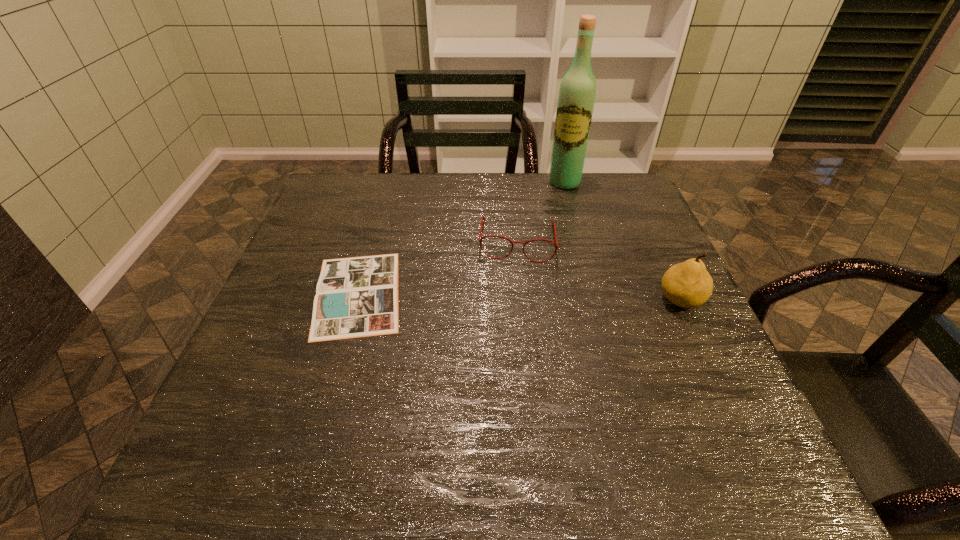
Locate an element on the screen. The image size is (960, 540). free region at the near edge of the desktop is located at coordinates (569, 419).

This screenshot has height=540, width=960. I want to click on free space at the left edge of the desktop, so click(x=299, y=248).

The image size is (960, 540). In order to click on blank space at the right edge of the desktop in this screenshot , I will do `click(646, 300)`.

Image resolution: width=960 pixels, height=540 pixels. Find the location of `blank space at the near left corner of the desktop`. blank space at the near left corner of the desktop is located at coordinates (230, 396).

Where is `free space at the far right corner`? The height and width of the screenshot is (540, 960). free space at the far right corner is located at coordinates (621, 199).

Where is `free location at the near right corner of the desktop`? This screenshot has height=540, width=960. free location at the near right corner of the desktop is located at coordinates (665, 421).

The image size is (960, 540). I want to click on vacant region between the spectacles and the rightmost object, so click(x=599, y=271).

Where is `empty space between the wine bottle and the leftmost object`? The width and height of the screenshot is (960, 540). empty space between the wine bottle and the leftmost object is located at coordinates (461, 238).

At what (x,y) coordinates should I click in order to perform the action: click on blank region between the pear and the wine bottle. Please return your answer as a coordinate pair (x, y). Looking at the image, I should click on (622, 241).

Identify the location of empty space between the third shortest object and the leftmost object. (519, 297).